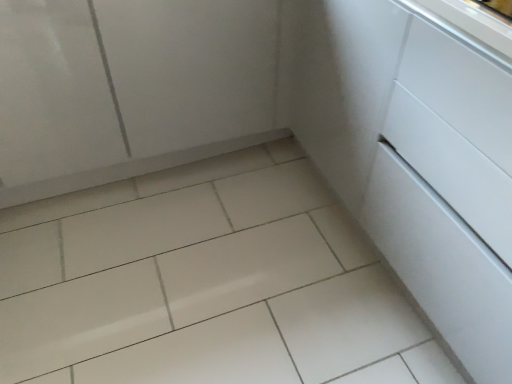
Question: Does white glossy cabinet at upper left have a greater width compared to white glossy tile at center?

Choices:
 (A) yes
 (B) no

Answer: (B)

Question: Is white glossy cabinet at upper left thinner than white glossy tile at center?

Choices:
 (A) no
 (B) yes

Answer: (B)

Question: Can you confirm if white glossy cabinet at upper left is bigger than white glossy tile at center?

Choices:
 (A) no
 (B) yes

Answer: (B)

Question: Is white glossy cabinet at upper left further to camera compared to white glossy tile at center?

Choices:
 (A) yes
 (B) no

Answer: (A)

Question: From a real-world perspective, is white glossy cabinet at upper left over white glossy tile at center?

Choices:
 (A) yes
 (B) no

Answer: (A)

Question: From a real-world perspective, is white glossy cabinet at upper left above or below white glossy drawer at center-right?

Choices:
 (A) below
 (B) above

Answer: (A)

Question: Which is correct: white glossy cabinet at upper left is inside white glossy drawer at center-right, or outside of it?

Choices:
 (A) inside
 (B) outside

Answer: (B)

Question: Visually, is white glossy cabinet at upper left positioned to the left or to the right of white glossy drawer at center-right?

Choices:
 (A) left
 (B) right

Answer: (A)

Question: Is white glossy cabinet at upper left wider or thinner than white glossy drawer at center-right?

Choices:
 (A) wide
 (B) thin

Answer: (B)

Question: Choose the correct answer: Is white glossy tile at center inside white glossy drawer at center-right or outside it?

Choices:
 (A) outside
 (B) inside

Answer: (A)

Question: Visually, is white glossy tile at center positioned to the left or to the right of white glossy drawer at center-right?

Choices:
 (A) left
 (B) right

Answer: (A)

Question: Relative to white glossy drawer at center-right, is white glossy tile at center in front or behind?

Choices:
 (A) behind
 (B) front

Answer: (A)

Question: From the image's perspective, is white glossy tile at center positioned above or below white glossy drawer at center-right?

Choices:
 (A) above
 (B) below

Answer: (B)

Question: From a real-world perspective, is white glossy tile at center above or below white glossy cabinet at upper left?

Choices:
 (A) below
 (B) above

Answer: (A)

Question: In terms of size, does white glossy tile at center appear bigger or smaller than white glossy cabinet at upper left?

Choices:
 (A) small
 (B) big

Answer: (A)